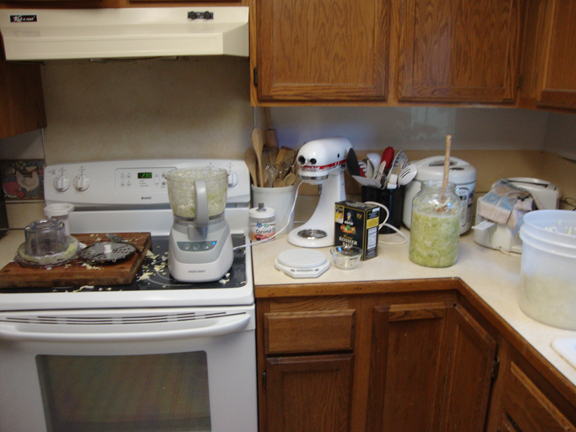
This screenshot has height=432, width=576. Find the location of `cabinets`. cabinets is located at coordinates (460, 32), (359, 35), (552, 69), (325, 381).